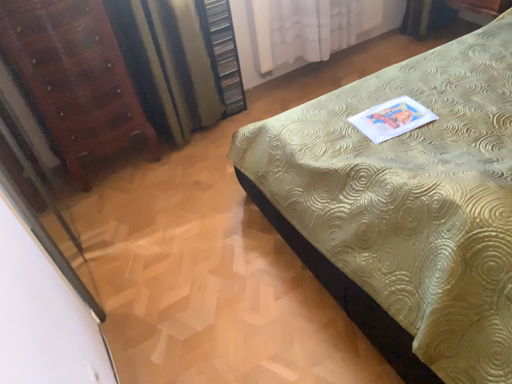
Question: Is mahogany wood dresser at left turned away from striped fabric curtain at left, marked as the first curtain in a left-to-right arrangement?

Choices:
 (A) yes
 (B) no

Answer: (B)

Question: Is striped fabric curtain at left, positioned as the 2th curtain in right-to-left order, completely or partially inside mahogany wood dresser at left?

Choices:
 (A) no
 (B) yes

Answer: (A)

Question: Does mahogany wood dresser at left have a larger size compared to striped fabric curtain at left, marked as the first curtain in a left-to-right arrangement?

Choices:
 (A) yes
 (B) no

Answer: (A)

Question: Is mahogany wood dresser at left located outside striped fabric curtain at left, marked as the first curtain in a left-to-right arrangement?

Choices:
 (A) yes
 (B) no

Answer: (A)

Question: Can you see mahogany wood dresser at left touching striped fabric curtain at left, positioned as the 2th curtain in right-to-left order?

Choices:
 (A) no
 (B) yes

Answer: (A)

Question: Considering the positions of white sheer curtain at upper center, the first curtain from the right, and gold textured bed at center in the image, is white sheer curtain at upper center, the first curtain from the right, wider or thinner than gold textured bed at center?

Choices:
 (A) thin
 (B) wide

Answer: (A)

Question: From their relative heights in the image, would you say white sheer curtain at upper center, the first curtain from the right, is taller or shorter than gold textured bed at center?

Choices:
 (A) tall
 (B) short

Answer: (B)

Question: Is white sheer curtain at upper center, the first curtain from the right, spatially inside gold textured bed at center, or outside of it?

Choices:
 (A) inside
 (B) outside

Answer: (B)

Question: In terms of size, does white sheer curtain at upper center, the first curtain from the right, appear bigger or smaller than gold textured bed at center?

Choices:
 (A) small
 (B) big

Answer: (A)

Question: Considering the positions of mahogany wood dresser at left and wooden dresser at upper center in the image, is mahogany wood dresser at left taller or shorter than wooden dresser at upper center?

Choices:
 (A) short
 (B) tall

Answer: (B)

Question: Looking at their shapes, would you say mahogany wood dresser at left is wider or thinner than wooden dresser at upper center?

Choices:
 (A) thin
 (B) wide

Answer: (B)

Question: From the image's perspective, relative to wooden dresser at upper center, is mahogany wood dresser at left above or below?

Choices:
 (A) above
 (B) below

Answer: (B)

Question: Is mahogany wood dresser at left inside the boundaries of wooden dresser at upper center, or outside?

Choices:
 (A) inside
 (B) outside

Answer: (B)

Question: From a real-world perspective, is transparent glass screen door at left physically located above or below mahogany wood dresser at left?

Choices:
 (A) above
 (B) below

Answer: (B)

Question: Based on their sizes in the image, would you say transparent glass screen door at left is bigger or smaller than mahogany wood dresser at left?

Choices:
 (A) small
 (B) big

Answer: (A)